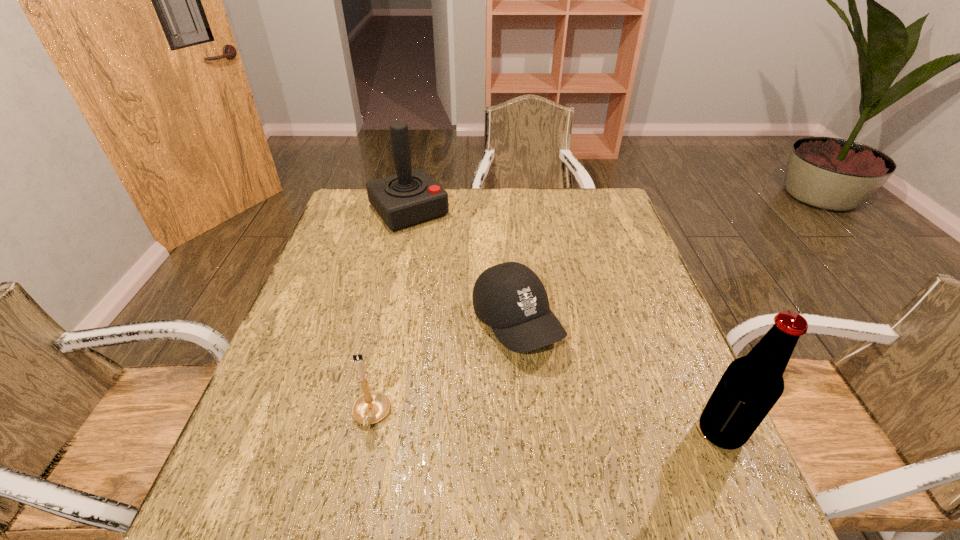
You are a GUI agent. You are given a task and a screenshot of the screen. Output one action in this format:
    pyautogui.click(x=<x>, y=<y>)
    Task: Click on the vacant space on the desktop that is between the candle holder and the beer bottle and is positioned on the base of the joystick
    The height and width of the screenshot is (540, 960).
    Given the screenshot: What is the action you would take?
    click(592, 426)

This screenshot has width=960, height=540. Identify the location of vacant space on the desktop that is between the second shortest object and the rightmost object and is positioned on the front-facing side of the third object from left to right. (592, 426).